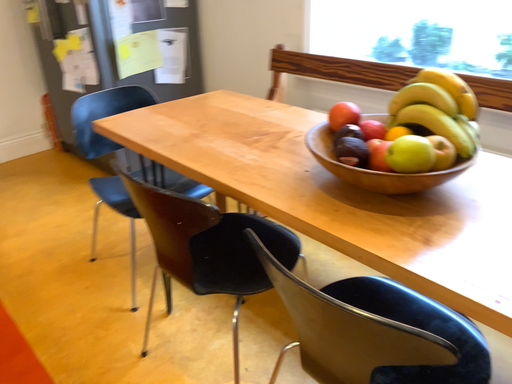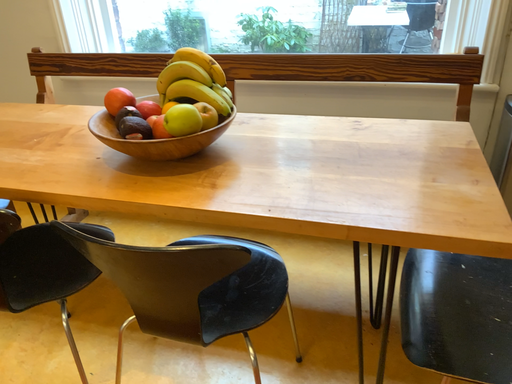
Question: How did the camera likely rotate when shooting the video?

Choices:
 (A) rotated right
 (B) rotated left

Answer: (A)